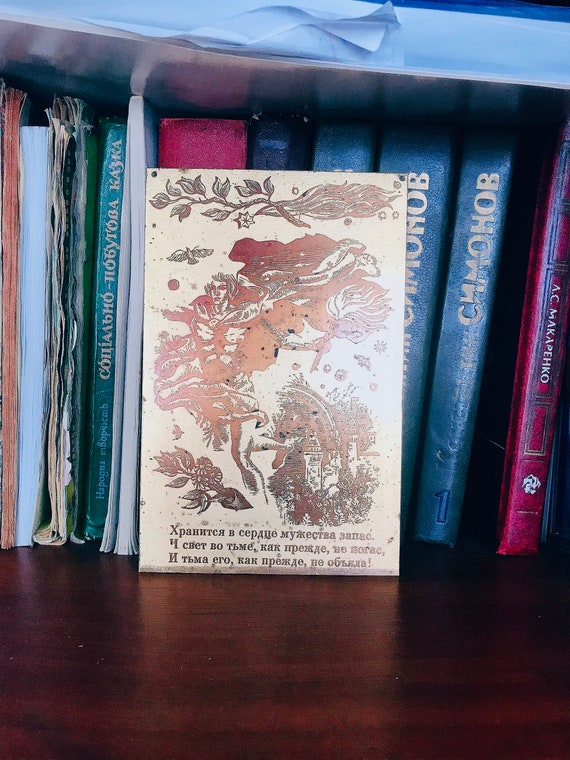
Identify the location of bookshelf. (313, 646).